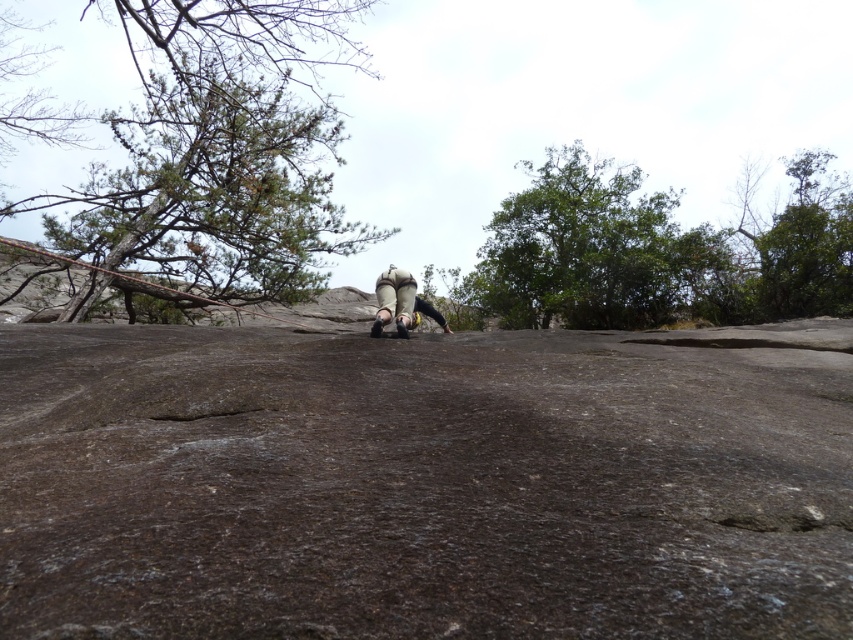
You are planning to take a photo of the green leafy tree at upper center and the matte gray climbing shoes at center. Which object should you zoom in more on to ensure both are clearly visible in the frame?

You should zoom in more on the green leafy tree at upper center because it is larger than the matte gray climbing shoes at center, so it will occupy more space in the photo.

From the picture: You are standing at the base of the rock and want to climb up to the point marked by point (608, 166). However, there is a loose rock at point (393, 284) that might block your path. Which point is closer to you, the climber, so you can decide the safest route?

Point (608, 166) is further to the camera than point (393, 284). Therefore, the loose rock at point (393, 284) is closer to you, so you should plan your route to avoid it or address the hazard first.

You are planning to take a photo of the large, flat rock in the foreground with the green textured tree at upper left in the background. Based on their positions, will the tree be mostly visible in the photo if you frame the shot to focus on the rock?

The green textured tree at upper left is located at point (210, 193), which means it will be positioned near the upper left corner of the photo. Since the rock is the main focus in the foreground, the tree will likely be mostly visible in the background as part of the scene.